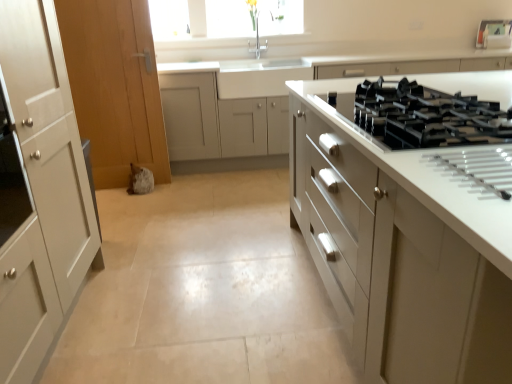
Question: Visually, is white glossy cabinet at right, the first cabinetry viewed from the front, positioned to the left or to the right of black glass gas stove at right?

Choices:
 (A) right
 (B) left

Answer: (A)

Question: Is white glossy cabinet at right, the second cabinetry viewed from the back, taller or shorter than black glass gas stove at right?

Choices:
 (A) short
 (B) tall

Answer: (B)

Question: Which object is positioned closest to the white glossy cabinetry at center, which is the second cabinetry in front-to-back order?

Choices:
 (A) white glossy cabinet at right, the second cabinetry viewed from the back
 (B) black glass gas stove at right

Answer: (A)

Question: Based on their relative distances, which object is farther from the black glass gas stove at right?

Choices:
 (A) white glossy cabinet at right, the first cabinetry viewed from the front
 (B) white glossy cabinetry at center, the first cabinetry in the back-to-front sequence

Answer: (B)